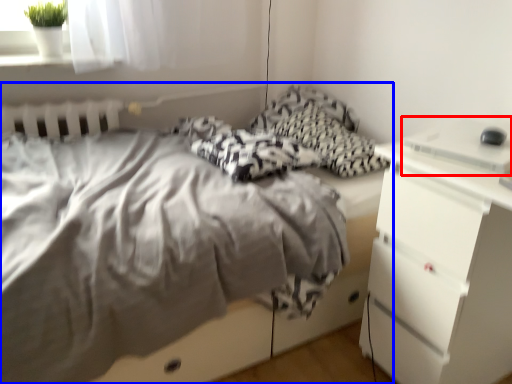
Question: Among these objects, which one is nearest to the camera, desktop (highlighted by a red box) or bed (highlighted by a blue box)?

Choices:
 (A) desktop
 (B) bed

Answer: (B)